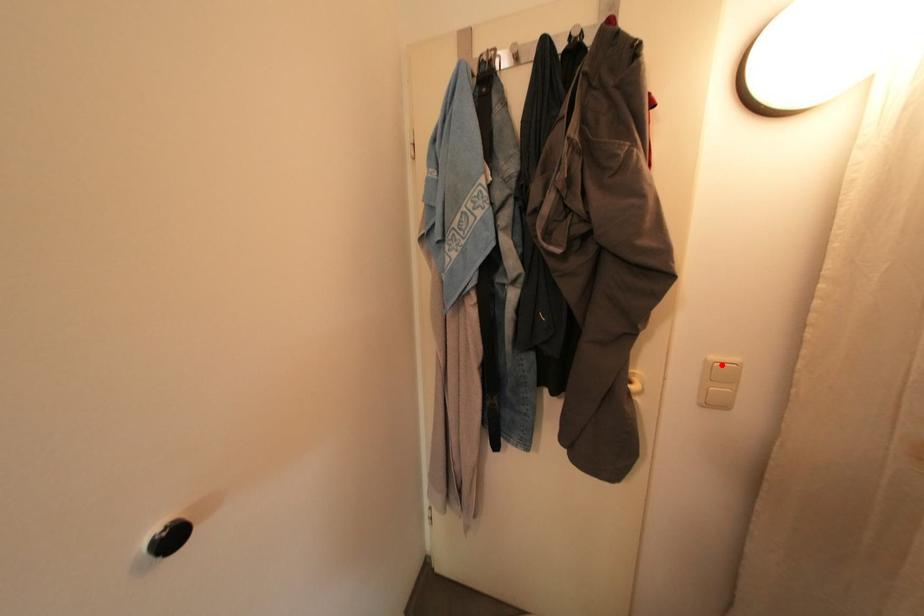
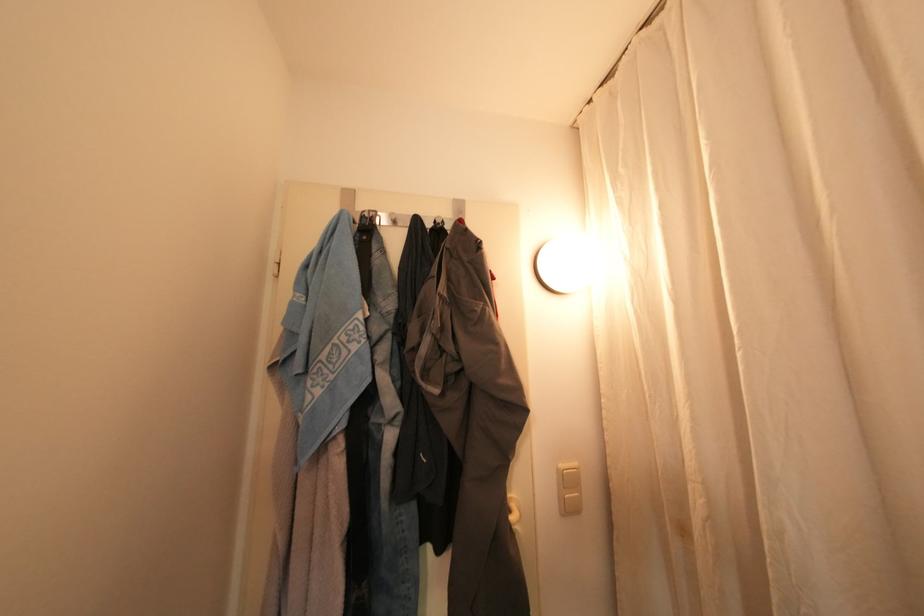
Question: I am providing you with two images of the same scene from different viewpoints. A red point is marked on the first image. Can you still see the location of the red point in image 2?

Choices:
 (A) Yes
 (B) No

Answer: (A)